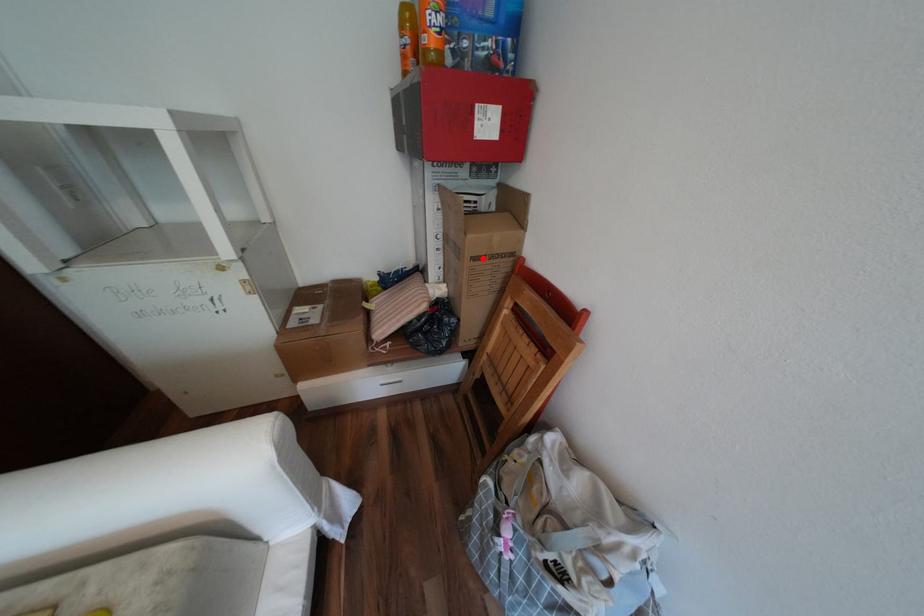
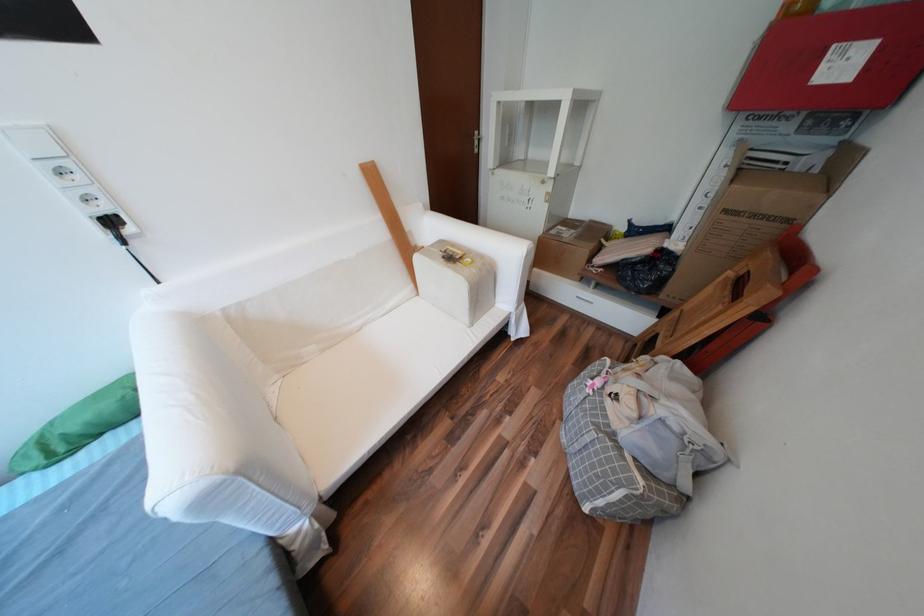
Locate, in the second image, the point that corresponds to the highlighted location in the first image.

(736, 211)